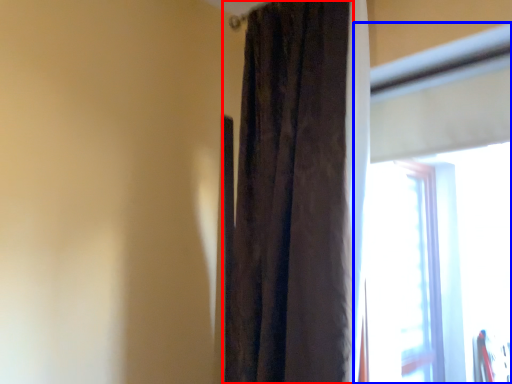
Question: Which object appears farthest to the camera in this image, curtain (highlighted by a red box) or window (highlighted by a blue box)?

Choices:
 (A) curtain
 (B) window

Answer: (A)